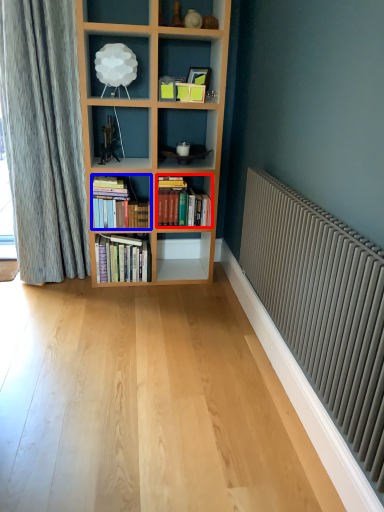
Question: Which object appears farthest to the camera in this image, book (highlighted by a red box) or book (highlighted by a blue box)?

Choices:
 (A) book
 (B) book

Answer: (A)